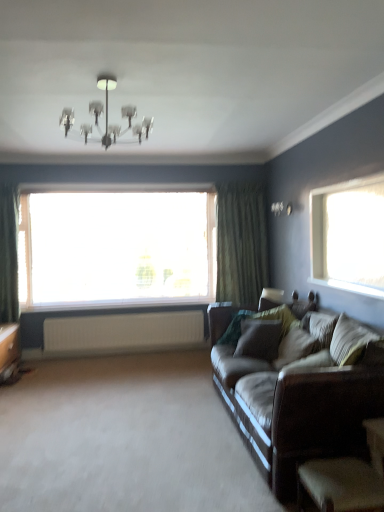
Question: From the image's perspective, is transparent glass window at center above green textured curtain at right?

Choices:
 (A) yes
 (B) no

Answer: (B)

Question: Considering the relative positions of transparent glass window at center and green textured curtain at right in the image provided, is transparent glass window at center to the left of green textured curtain at right from the viewer's perspective?

Choices:
 (A) yes
 (B) no

Answer: (A)

Question: Is the depth of transparent glass window at center less than that of green textured curtain at right?

Choices:
 (A) yes
 (B) no

Answer: (A)

Question: Considering the relative sizes of transparent glass window at center and green textured curtain at right in the image provided, is transparent glass window at center bigger than green textured curtain at right?

Choices:
 (A) no
 (B) yes

Answer: (B)

Question: Is transparent glass window at center not within green textured curtain at right?

Choices:
 (A) no
 (B) yes

Answer: (B)

Question: Can you confirm if transparent glass window at center is wider than green textured curtain at right?

Choices:
 (A) no
 (B) yes

Answer: (A)

Question: From a real-world perspective, is dark brown leather armchair at lower right physically below metallic chandelier at upper center?

Choices:
 (A) no
 (B) yes

Answer: (B)

Question: From the image's perspective, would you say dark brown leather armchair at lower right is positioned over metallic chandelier at upper center?

Choices:
 (A) yes
 (B) no

Answer: (B)

Question: Is dark brown leather armchair at lower right facing towards metallic chandelier at upper center?

Choices:
 (A) yes
 (B) no

Answer: (B)

Question: Is dark brown leather armchair at lower right turned away from metallic chandelier at upper center?

Choices:
 (A) no
 (B) yes

Answer: (A)

Question: Does dark brown leather armchair at lower right have a greater width compared to metallic chandelier at upper center?

Choices:
 (A) no
 (B) yes

Answer: (A)

Question: Would you say dark brown leather armchair at lower right is a long distance from metallic chandelier at upper center?

Choices:
 (A) yes
 (B) no

Answer: (A)

Question: Can you confirm if white ribbed radiator at lower center is thinner than brown leather couch at right?

Choices:
 (A) no
 (B) yes

Answer: (B)